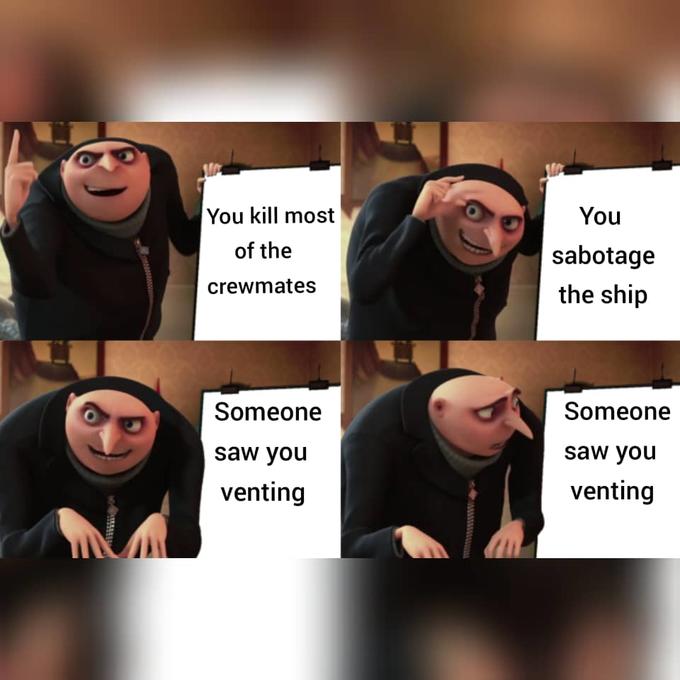
Image resolution: width=680 pixels, height=680 pixels. I want to click on shelf, so click(398, 149), click(381, 369), click(62, 371), click(50, 147).